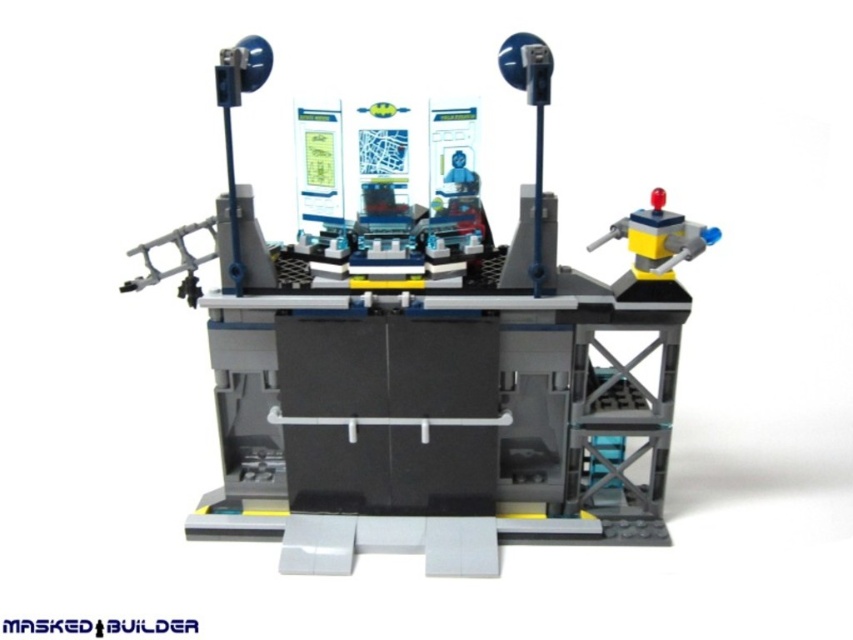
Between matte gray robot at upper right and yellow plastic robot at upper right, which one is positioned higher?

yellow plastic robot at upper right is above.

Which is below, matte gray robot at upper right or yellow plastic robot at upper right?

matte gray robot at upper right is lower down.

Identify the location of matte gray robot at upper right. This screenshot has height=640, width=853. (418, 360).